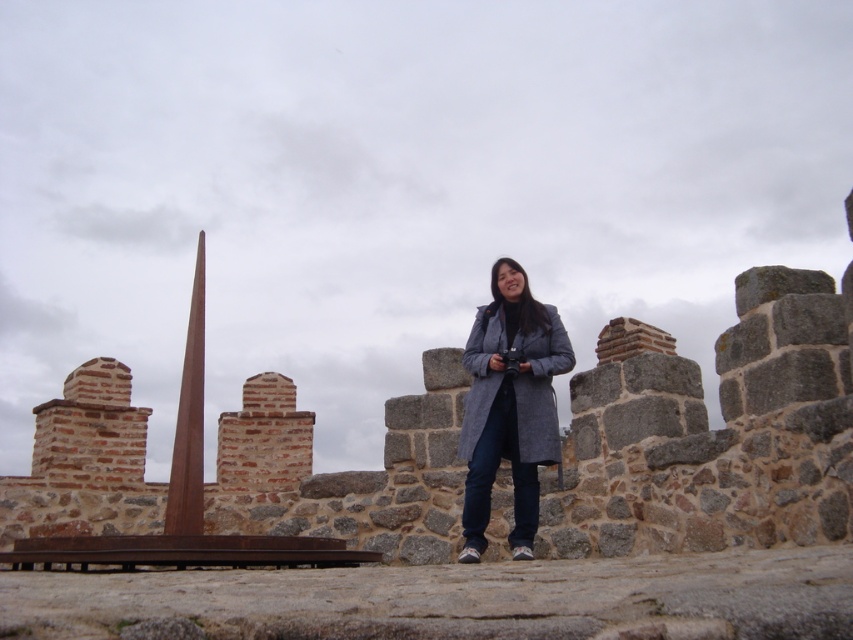
You are a photographer trying to capture the brown stone ruins at center and the gray wool coat at center in your shot. Which object is wider in the image?

The brown stone ruins at center is wider than the gray wool coat at center.

You are a drone operator trying to navigate between two points marked in the image. The first point is at coordinates point (341, 509) and the second is at point (474, 396). Which point is closer to the camera?

Point (474, 396) is closer to the camera because the description states that point (341, 509) is behind point (474, 396).

You are standing at the base of the stone wall and want to take a photo of the point marked at coordinates [105,404]. Given that your camera has a maximum zoom range of 50 meters, will you be able to capture the point clearly?

The point at coordinates [105,404] is 67.29 meters away from the viewer. Since your camera can only zoom up to 50 meters, you won t be able to capture the point clearly at this distance.